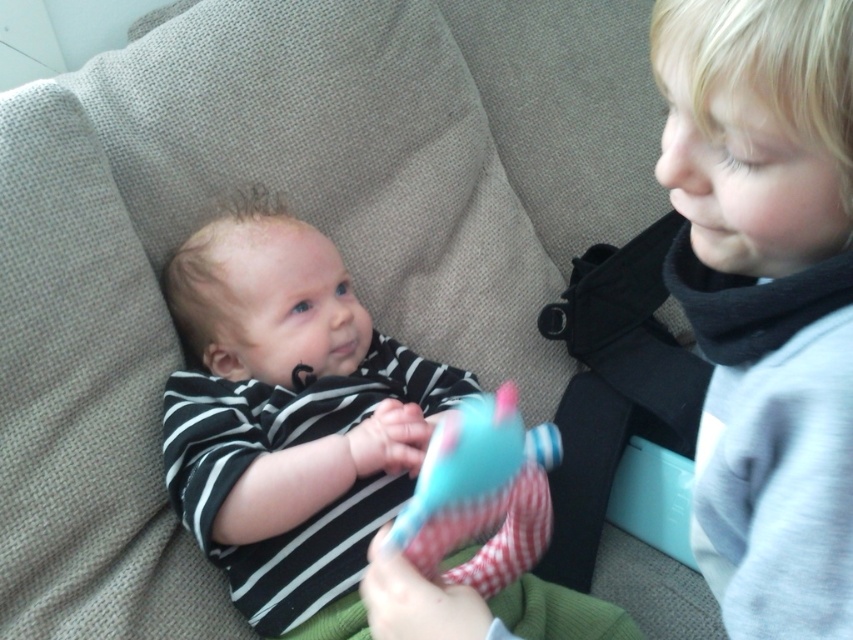
Which is in front, point (264, 612) or point (546, 467)?

Positioned in front is point (264, 612).

Is point (207, 276) behind point (471, 529)?

Yes, it is behind point (471, 529).

Does point (221, 292) lie behind point (424, 531)?

Yes, point (221, 292) is behind point (424, 531).

You are a GUI agent. You are given a task and a screenshot of the screen. Output one action in this format:
    pyautogui.click(x=<x>, y=<y>)
    Task: Click on the striped fabric baby at center
    The image size is (853, 640).
    Given the screenshot: What is the action you would take?
    pyautogui.click(x=289, y=417)

Does point (755, 600) come closer to viewer compared to point (445, 465)?

That is True.

Between smooth gray sweater at right and plush cotton toy at center, which one appears on the left side from the viewer's perspective?

plush cotton toy at center is more to the left.

Does point (804, 445) come closer to viewer compared to point (492, 401)?

Yes, it is.

Image resolution: width=853 pixels, height=640 pixels. Identify the location of smooth gray sweater at right. (766, 298).

Which of these two, smooth gray sweater at right or striped fabric baby at center, stands shorter?

Standing shorter between the two is smooth gray sweater at right.

This screenshot has width=853, height=640. I want to click on smooth gray sweater at right, so click(766, 298).